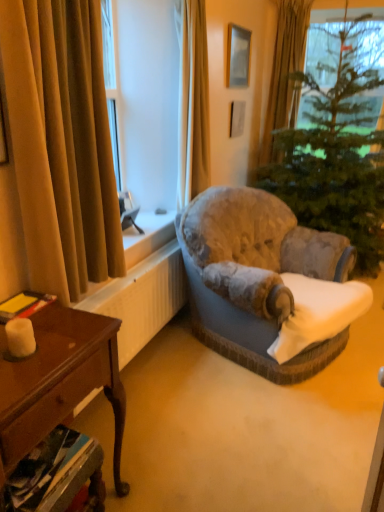
At what (x,y) coordinates should I click in order to perform the action: click on vacant space behind white matte candle at lower left. Please return your answer as a coordinate pair (x, y). Looking at the image, I should click on (56, 326).